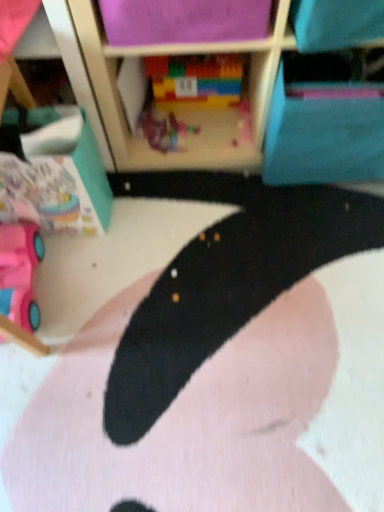
This screenshot has height=512, width=384. What are the coordinates of `spots to the right of pink plastic toy car at lower left, the third toy from the top` in the screenshot? It's located at (93, 289).